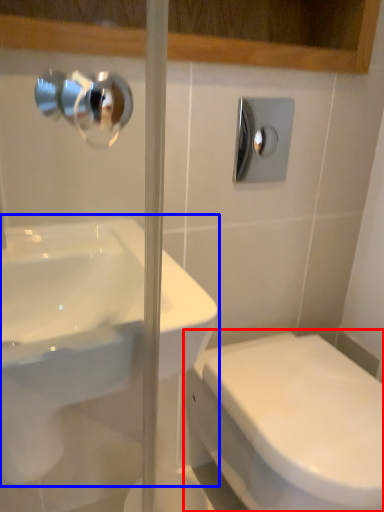
Question: Which object is further to the camera taking this photo, toilet (highlighted by a red box) or sink (highlighted by a blue box)?

Choices:
 (A) toilet
 (B) sink

Answer: (A)